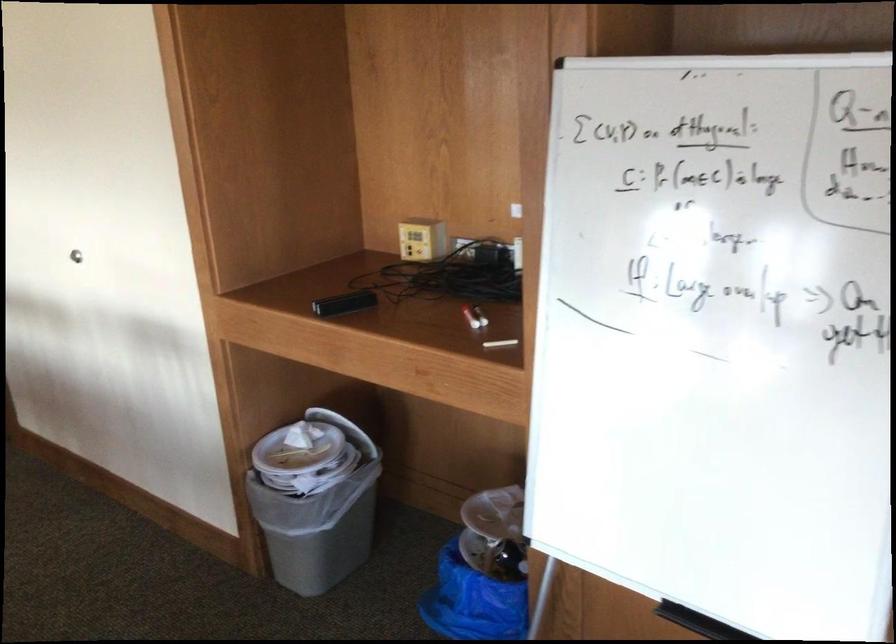
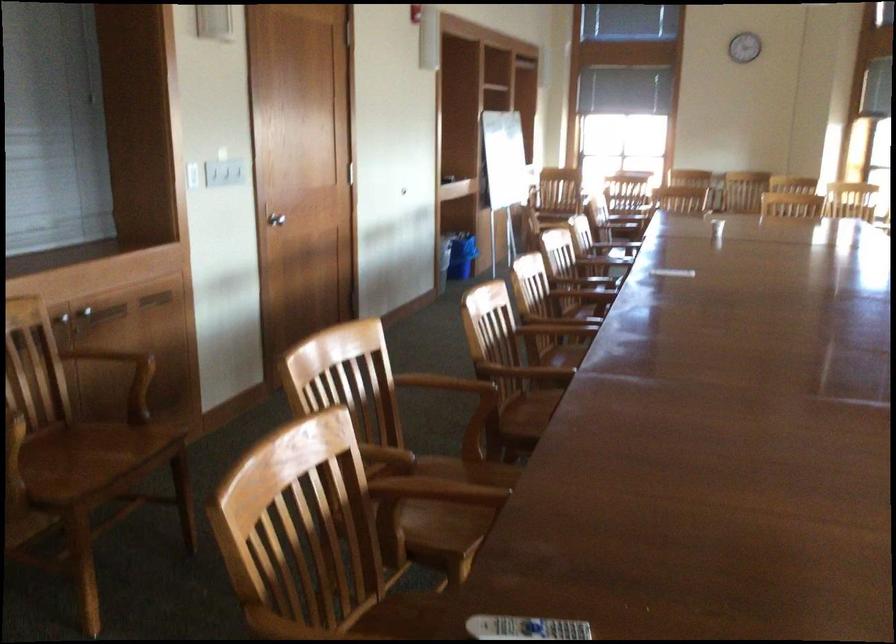
Question: I am providing you with two images of the same scene from different viewpoints. Please identify which objects are invisible in image2.

Choices:
 (A) white paper plate
 (B) small cleaning bottle
 (C) white remote control
 (D) wooden chair armrest

Answer: (A)